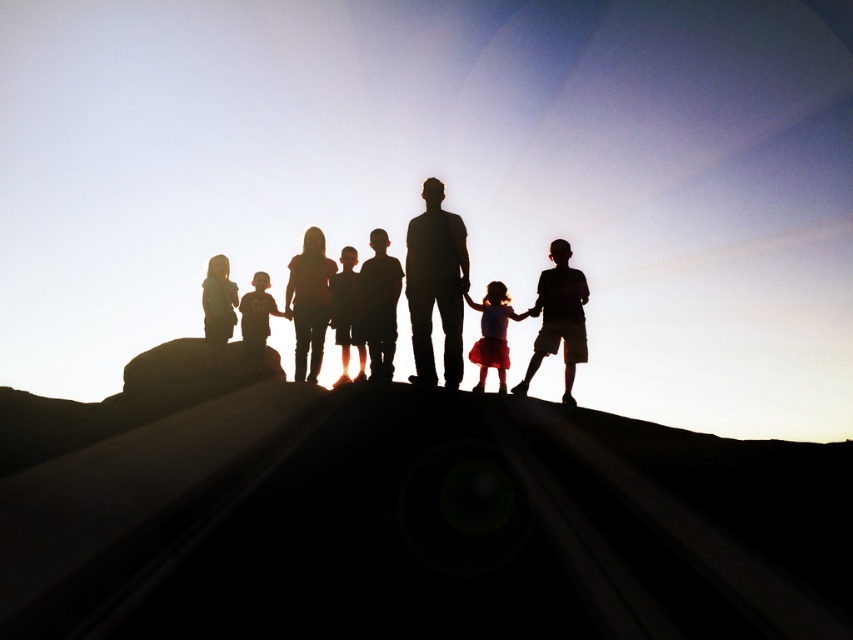
Does point (500, 326) come in front of point (227, 291)?

Yes, point (500, 326) is closer to viewer.

Does point (479, 342) lie behind point (219, 294)?

No.

Where is `matte pink skirt at center`? Image resolution: width=853 pixels, height=640 pixels. matte pink skirt at center is located at coordinates (492, 333).

The image size is (853, 640). Find the location of `silhouette boy at center`. silhouette boy at center is located at coordinates (558, 317).

Is point (543, 280) positioned in front of point (363, 323)?

That is True.

Identify the location of silhouette boy at center. The height and width of the screenshot is (640, 853). (558, 317).

Who is positioned more to the left, silhouette rock at center or matte black girl at center?

matte black girl at center

Is silhouette rock at center positioned at the back of matte black girl at center?

That is False.

You are a GUI agent. You are given a task and a screenshot of the screen. Output one action in this format:
    pyautogui.click(x=<x>, y=<y>)
    Task: Click on the silhouette rock at center
    
    Given the screenshot: What is the action you would take?
    pyautogui.click(x=426, y=525)